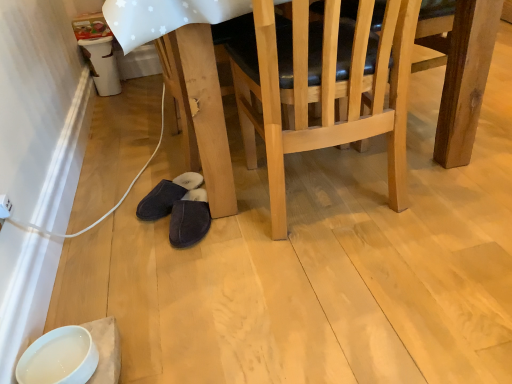
Identify the location of free spot to the right of natural wood chair at center. (455, 182).